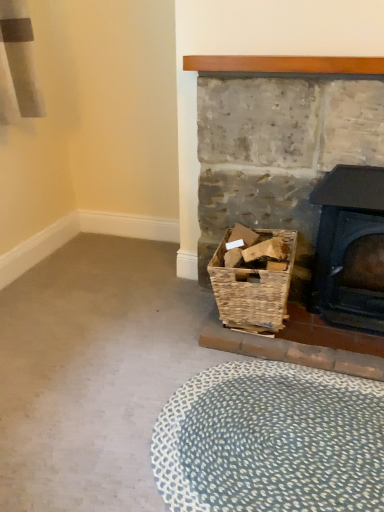
Question: Looking at their shapes, would you say rustic wicker basket at lower right is wider or thinner than woven brown basket at lower right?

Choices:
 (A) thin
 (B) wide

Answer: (A)

Question: Is rustic wicker basket at lower right inside or outside of woven brown basket at lower right?

Choices:
 (A) outside
 (B) inside

Answer: (A)

Question: Based on their relative distances, which object is farther from the woven brown basket at lower right?

Choices:
 (A) rustic wicker basket at lower right
 (B) blue textured rug at lower center
 (C) black cast iron wood burning stove at right

Answer: (B)

Question: Which of these objects is positioned farthest from the rustic wicker basket at lower right?

Choices:
 (A) blue textured rug at lower center
 (B) black cast iron wood burning stove at right
 (C) woven brown basket at lower right

Answer: (A)